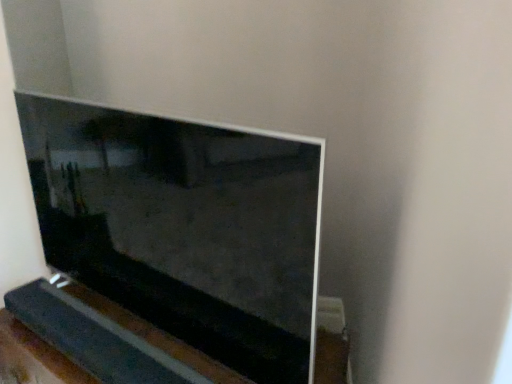
Question: Are matte black television at center and black wood at lower left located far from each other?

Choices:
 (A) no
 (B) yes

Answer: (A)

Question: From the image's perspective, is matte black television at center above black wood at lower left?

Choices:
 (A) yes
 (B) no

Answer: (A)

Question: From a real-world perspective, is matte black television at center located beneath black wood at lower left?

Choices:
 (A) yes
 (B) no

Answer: (B)

Question: Is matte black television at center positioned with its back to black wood at lower left?

Choices:
 (A) yes
 (B) no

Answer: (B)

Question: Could you tell me if matte black television at center is facing black wood at lower left?

Choices:
 (A) yes
 (B) no

Answer: (A)

Question: Would you say black wood at lower left is part of matte black television at center's contents?

Choices:
 (A) yes
 (B) no

Answer: (B)

Question: Does black wood at lower left have a smaller size compared to matte black television at center?

Choices:
 (A) no
 (B) yes

Answer: (B)

Question: From the image's perspective, is black wood at lower left located above matte black television at center?

Choices:
 (A) no
 (B) yes

Answer: (A)

Question: Does black wood at lower left come behind matte black television at center?

Choices:
 (A) yes
 (B) no

Answer: (A)

Question: Is black wood at lower left turned away from matte black television at center?

Choices:
 (A) yes
 (B) no

Answer: (A)

Question: From the image's perspective, is black wood at lower left beneath matte black television at center?

Choices:
 (A) yes
 (B) no

Answer: (A)

Question: Does black wood at lower left come in front of matte black television at center?

Choices:
 (A) no
 (B) yes

Answer: (A)

Question: Looking at their shapes, would you say black wood at lower left is wider or thinner than matte black television at center?

Choices:
 (A) thin
 (B) wide

Answer: (A)